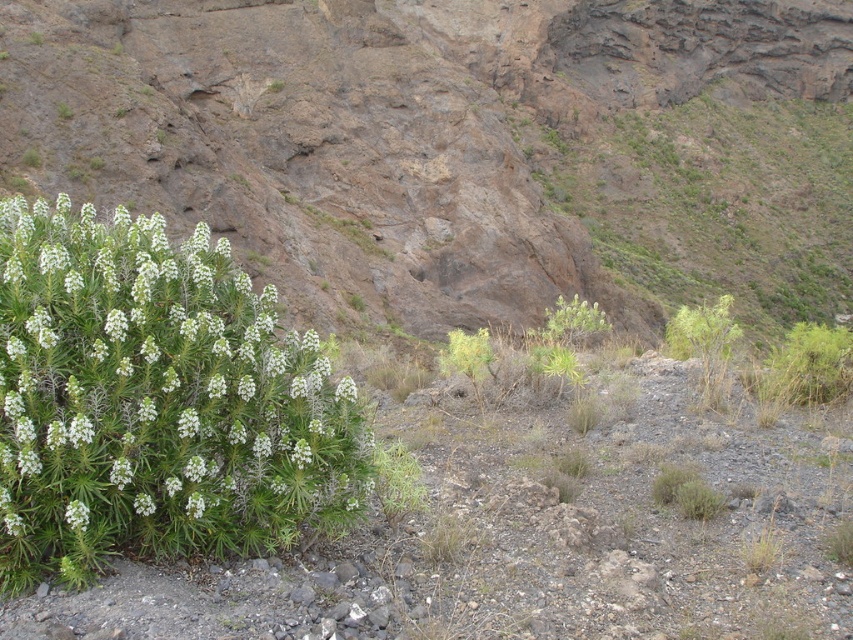
You are a hiker standing at the base of the steep, rocky hillside. You see the green grassy hillside at lower left and the green leafy plant at lower left. Which one is closer to you?

The green leafy plant at lower left is closer because the distance between them is 64.39 meters, so the green leafy plant at lower left is nearer to your current position.

You are standing in the middle of the rugged, arid landscape. You notice the green grassy hillside at lower left and the green leafy plant at left. Which of these two objects covers a larger area?

The green grassy hillside at lower left might be wider than green leafy plant at left, so it likely covers a larger area.

You are standing in the center of the rugged, arid landscape described. You want to move to the green grassy hillside at lower left. Which direction should you walk to reach it?

The green grassy hillside at lower left is located at point [459,148], so you should walk towards the lower left direction to reach it.